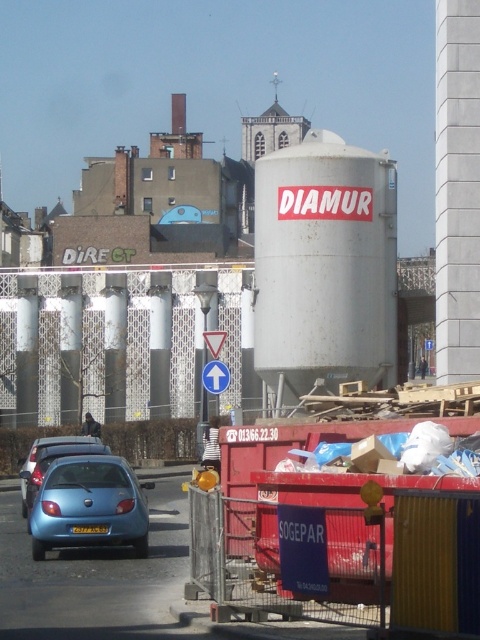
You are a delivery driver who needs to drive a truck that is 4 meters tall through the street where the rusty metal water tower at center and the white plastic traffic sign at center are located. Based on the scene, can your truck pass under the tallest object in this area?

The rusty metal water tower at center is much taller than the white plastic traffic sign at center. Since the water tower is the tallest object, and its height isn not specified, but the truck is 4 meters tall, it is uncertain whether the truck can pass under it without more information about the water tower

In the scene shown: You are a city planner reviewing this area. You need to install a new 30 feet wide emergency access road between the rusty metal water tower at center and the white plastic traffic sign at center. Is there enough space?

The rusty metal water tower at center and the white plastic traffic sign at center are 62.21 feet apart. Since the required space for the road is 30 feet, there is sufficient space to install the emergency access road between them.

You are standing at the construction site and want to place a new sign between the two points, point (31, 477) and point (214, 368). Which point should the sign be closer to if you want it to be more visible to people approaching from the front of the site?

The sign should be placed closer to point (31, 477) because it is closer to the viewer, making it more visible to those approaching from the front of the site.